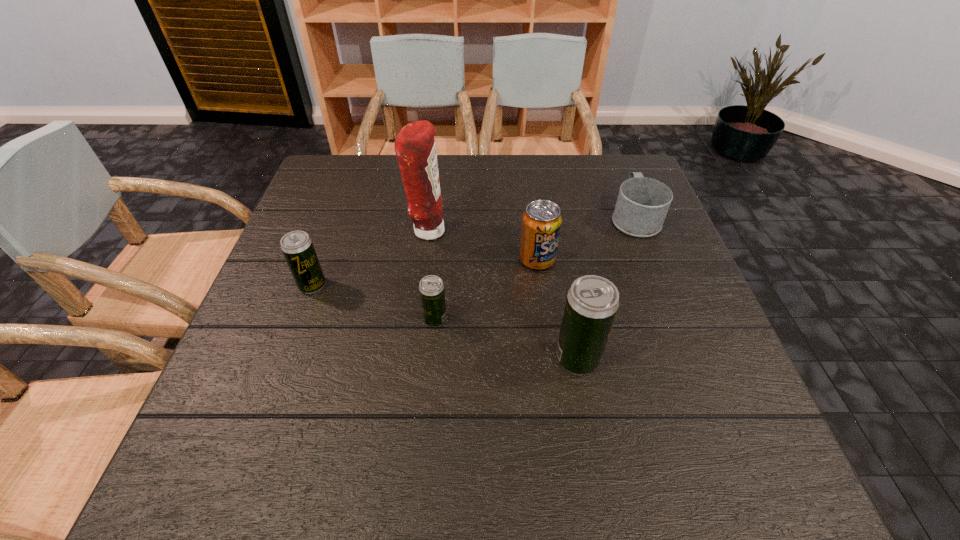
Find the location of a particular element. free space between the rightmost object and the second shortest beer can is located at coordinates (473, 251).

Locate an element on the screen. Image resolution: width=960 pixels, height=540 pixels. vacant space that is in between the second tallest beer can and the second beer can from left to right is located at coordinates (373, 302).

This screenshot has height=540, width=960. In order to click on the second closest object to the shortest beer can in this screenshot , I will do `click(415, 148)`.

Locate which object ranks in proximity to the mug. Please provide its 2D coordinates. Your answer should be formatted as a tuple, i.e. [(x, y)], where the tuple contains the x and y coordinates of a point satisfying the conditions above.

[(541, 224)]

Where is `beer can object that ranks as the second closest to the nearest beer can`? The height and width of the screenshot is (540, 960). beer can object that ranks as the second closest to the nearest beer can is located at coordinates (297, 247).

You are a GUI agent. You are given a task and a screenshot of the screen. Output one action in this format:
    pyautogui.click(x=<x>, y=<y>)
    Task: Click on the beer can that is the second closest to the rightmost object
    This screenshot has height=540, width=960.
    Given the screenshot: What is the action you would take?
    [x=431, y=288]

Image resolution: width=960 pixels, height=540 pixels. I want to click on free space that satisfies the following two spatial constraints: 1. on the front side of the shortest beer can; 2. on the left side of the tallest object, so click(x=416, y=319).

In order to click on vacant space that satisfies the following two spatial constraints: 1. on the front side of the tallest object; 2. on the left side of the second beer can from left to right in this screenshot , I will do `click(416, 319)`.

Where is `vacant space that satisfies the following two spatial constraints: 1. on the front side of the nearest beer can; 2. on the right side of the farthest beer can`? The image size is (960, 540). vacant space that satisfies the following two spatial constraints: 1. on the front side of the nearest beer can; 2. on the right side of the farthest beer can is located at coordinates (286, 359).